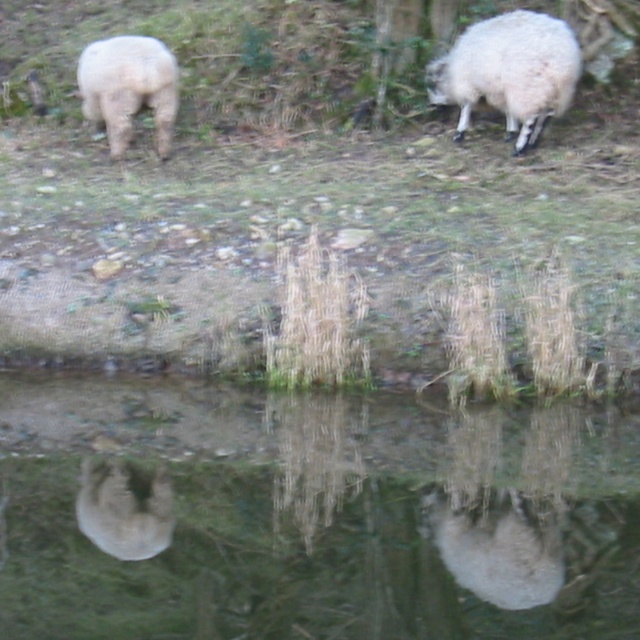
You are a photographer trying to capture a reflection of the white fluffy sheep at lower center in the transparent glass puddle at center. Based on their positions, can you determine if the reflection of the sheep will appear in the puddle?

The transparent glass puddle at center and white fluffy sheep at lower center are 19.92 inches apart from each other. Since the puddle is at center and the sheep is at lower center, the reflection of the white fluffy sheep at lower center will appear in the transparent glass puddle at center if they are positioned within the reflection area. However, the exact distance and angle determine this, but given their proximity, it is likely possible.